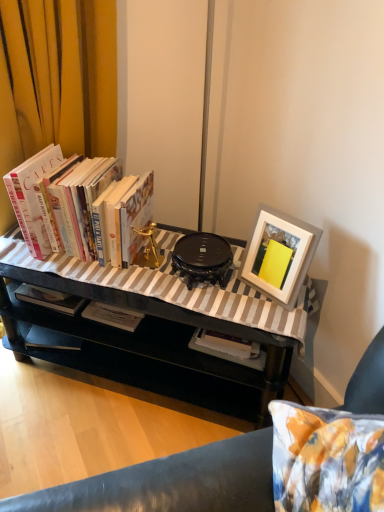
Question: Considering the relative sizes of hardcover books at left and white matte picture frame at upper right in the image provided, is hardcover books at left wider than white matte picture frame at upper right?

Choices:
 (A) no
 (B) yes

Answer: (B)

Question: From the image's perspective, is hardcover books at left beneath white matte picture frame at upper right?

Choices:
 (A) yes
 (B) no

Answer: (B)

Question: From a real-world perspective, is hardcover books at left located beneath white matte picture frame at upper right?

Choices:
 (A) no
 (B) yes

Answer: (A)

Question: Is hardcover books at left to the right of white matte picture frame at upper right from the viewer's perspective?

Choices:
 (A) yes
 (B) no

Answer: (B)

Question: Is hardcover books at left touching white matte picture frame at upper right?

Choices:
 (A) no
 (B) yes

Answer: (A)

Question: Is hardcover books at left in front of or behind black glossy table at center in the image?

Choices:
 (A) behind
 (B) front

Answer: (A)

Question: Considering the positions of hardcover books at left and black glossy table at center in the image, is hardcover books at left taller or shorter than black glossy table at center?

Choices:
 (A) short
 (B) tall

Answer: (A)

Question: Does point (66, 194) appear closer or farther from the camera than point (180, 388)?

Choices:
 (A) closer
 (B) farther

Answer: (A)

Question: Considering the positions of hardcover books at left and black glossy table at center in the image, is hardcover books at left wider or thinner than black glossy table at center?

Choices:
 (A) wide
 (B) thin

Answer: (B)

Question: Based on their sizes in the image, would you say white matte picture frame at upper right is bigger or smaller than hardcover books at left?

Choices:
 (A) big
 (B) small

Answer: (B)

Question: Is point (261, 229) positioned closer to the camera than point (150, 174)?

Choices:
 (A) farther
 (B) closer

Answer: (B)

Question: Is white matte picture frame at upper right spatially inside hardcover books at left, or outside of it?

Choices:
 (A) inside
 (B) outside

Answer: (B)

Question: Looking at their shapes, would you say white matte picture frame at upper right is wider or thinner than hardcover books at left?

Choices:
 (A) thin
 (B) wide

Answer: (A)

Question: Is point (187, 369) positioned closer to the camera than point (261, 257)?

Choices:
 (A) farther
 (B) closer

Answer: (A)

Question: Based on their sizes in the image, would you say black glossy table at center is bigger or smaller than white matte picture frame at upper right?

Choices:
 (A) small
 (B) big

Answer: (B)